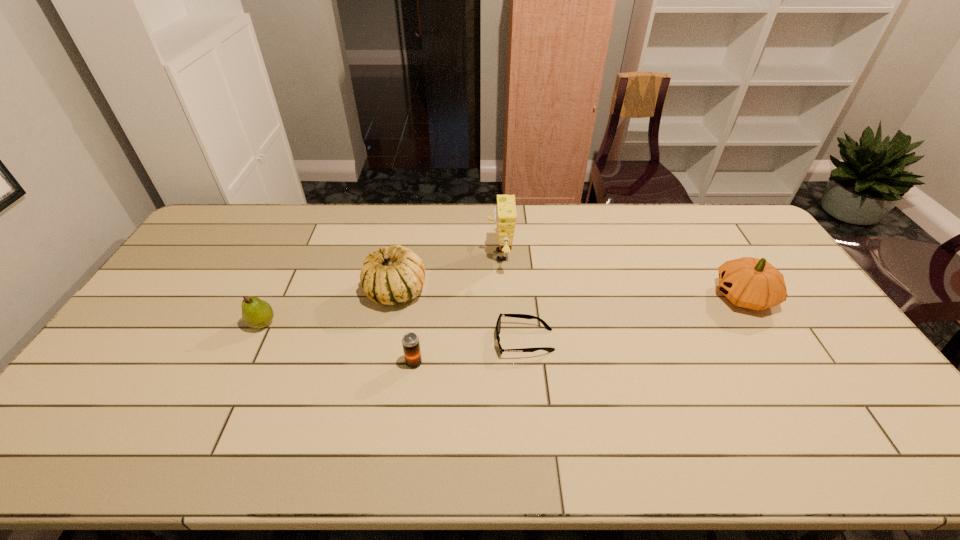
Find the location of `vacant position at the far edge of the desktop`. vacant position at the far edge of the desktop is located at coordinates (392, 240).

Locate an element on the screen. The image size is (960, 540). blank area at the left edge is located at coordinates (195, 251).

Locate an element on the screen. The height and width of the screenshot is (540, 960). vacant region at the far left corner of the desktop is located at coordinates 230,237.

This screenshot has height=540, width=960. Identify the location of vacant space that is in between the left gourd and the sunglasses. (x=460, y=316).

Find the location of a particular element. This screenshot has width=960, height=540. vacant space that is in between the tallest object and the beer can is located at coordinates (457, 309).

This screenshot has height=540, width=960. I want to click on vacant region between the leftmost object and the right gourd, so click(x=503, y=310).

The height and width of the screenshot is (540, 960). Identify the location of free spot between the rightmost object and the tallest object. (x=621, y=276).

What are the coordinates of `free space between the right gourd and the leftmost object` in the screenshot? It's located at (503, 310).

Find the location of a particular element. The height and width of the screenshot is (540, 960). free space between the leftmost object and the beer can is located at coordinates [x=338, y=343].

Identify the location of free space between the shortest object and the leftmost object. (394, 332).